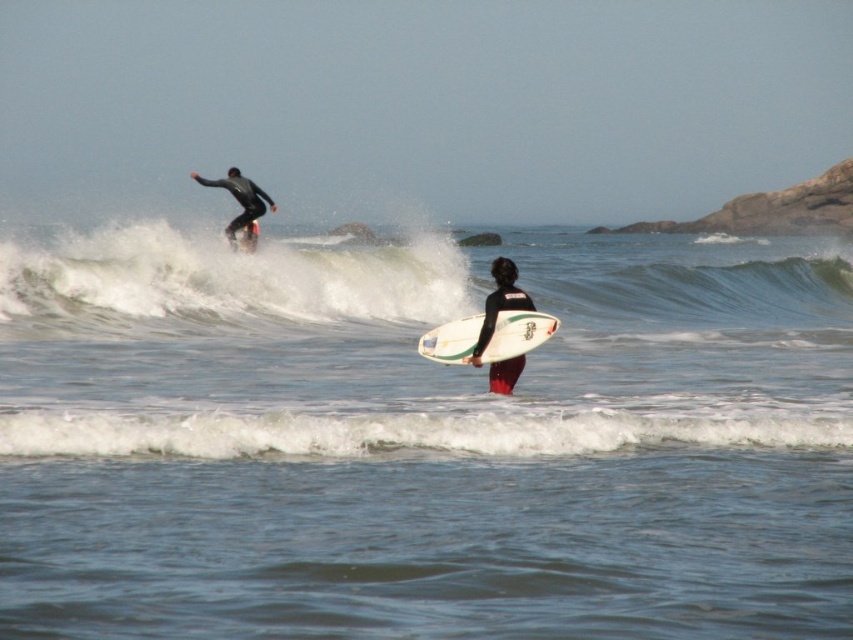
You are a photographer trying to capture a clear photo of both the white glossy surfboard at center and the black matte wetsuit at center. Given that your camera can focus on objects within a 15 inch range, will you be able to get both in focus at the same time?

The distance between the white glossy surfboard at center and the black matte wetsuit at center is 16.42 inches. Since your camera can only focus within a 15 inch range, you won cannot capture both in focus simultaneously.

You are planning to place a new buoy in the ocean scene shown. The buoy needs to be positioned exactly 0.1 units to the right of the white glossy surfboard at center. What are the coordinates where you should place the buoy?

The white glossy surfboard at center is located at point (518, 333). Adding 0.1 to the x coordinate gives 0.622, so the buoy should be placed at coordinates (518, 397).

You are a photographer trying to capture a wide shot of the ocean scene. You notice the clear blue water at center and the black matte wetsuit at upper left. Which object should you focus on to ensure it appears bigger in your photo?

The clear blue water at center should be focused on because it is larger in size than the black matte wetsuit at upper left, making it the better choice for a prominent feature in the photo.